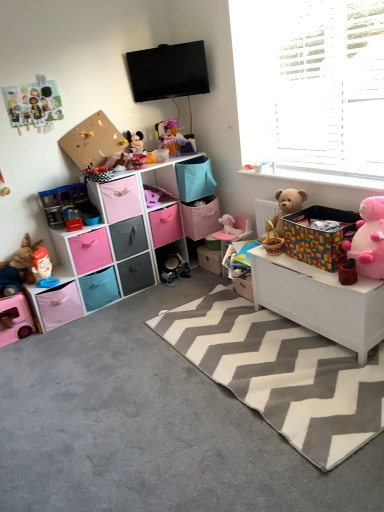
Locate an element on the screen. Image resolution: width=384 pixels, height=512 pixels. vacant space in front of pink plastic toy car at lower left, the seventh toy positioned from the right is located at coordinates (16, 353).